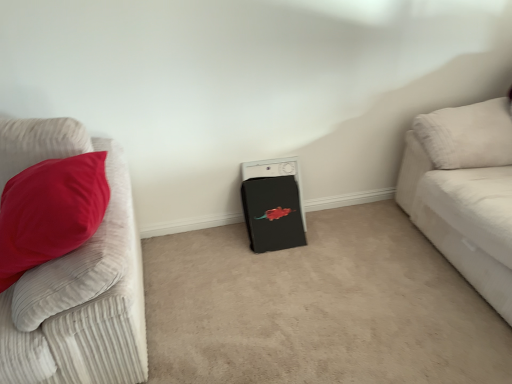
This screenshot has width=512, height=384. Describe the element at coordinates (464, 192) in the screenshot. I see `white corduroy couch at right, the 2th studio couch when ordered from left to right` at that location.

The image size is (512, 384). Identify the location of velvet red pillow at left, placed as the 1th studio couch when sorted from left to right. (77, 277).

What is the approximate width of black matte washing machine at center?

black matte washing machine at center is 24.43 centimeters wide.

I want to click on white corduroy couch at right, the first studio couch viewed from the right, so click(x=464, y=192).

Is point (269, 211) in front of point (509, 116)?

That is False.

Is black matte washing machine at center oriented away from white corduroy couch at right, the 2th studio couch when ordered from left to right?

No, black matte washing machine at center is not facing away from white corduroy couch at right, the 2th studio couch when ordered from left to right.

Which object is positioned more to the left, black matte washing machine at center or white corduroy couch at right, the first studio couch viewed from the right?

black matte washing machine at center is more to the left.

Between black matte washing machine at center and white corduroy couch at right, the first studio couch viewed from the right, which one is positioned in front?

white corduroy couch at right, the first studio couch viewed from the right, is closer to the camera.

Considering the relative sizes of velvet red pillow at left, placed as the 1th studio couch when sorted from left to right, and white corduroy couch at right, the 2th studio couch when ordered from left to right, in the image provided, is velvet red pillow at left, placed as the 1th studio couch when sorted from left to right, smaller than white corduroy couch at right, the 2th studio couch when ordered from left to right,?

Correct, velvet red pillow at left, placed as the 1th studio couch when sorted from left to right, occupies less space than white corduroy couch at right, the 2th studio couch when ordered from left to right.

The image size is (512, 384). Find the location of `studio couch below the white corduroy couch at right, the 2th studio couch when ordered from left to right (from the image's perspective)`. studio couch below the white corduroy couch at right, the 2th studio couch when ordered from left to right (from the image's perspective) is located at coordinates (77, 277).

Is velvet red pillow at left, placed as the 1th studio couch when sorted from left to right, directly adjacent to white corduroy couch at right, the 2th studio couch when ordered from left to right?

velvet red pillow at left, placed as the 1th studio couch when sorted from left to right, is not next to white corduroy couch at right, the 2th studio couch when ordered from left to right, and they're not touching.

From the image's perspective, between velvet red pillow at left, placed as the 1th studio couch when sorted from left to right, and white corduroy couch at right, the 2th studio couch when ordered from left to right, which one is located above?

From the image's view, white corduroy couch at right, the 2th studio couch when ordered from left to right, is above.

Is point (41, 144) less distant than point (283, 177)?

Yes.

Considering the relative sizes of velvet red pillow at left, placed as the 2th studio couch when sorted from right to left, and black matte washing machine at center in the image provided, is velvet red pillow at left, placed as the 2th studio couch when sorted from right to left, taller than black matte washing machine at center?

Indeed, velvet red pillow at left, placed as the 2th studio couch when sorted from right to left, has a greater height compared to black matte washing machine at center.

Is velvet red pillow at left, placed as the 2th studio couch when sorted from right to left, to the left of black matte washing machine at center from the viewer's perspective?

Yes, velvet red pillow at left, placed as the 2th studio couch when sorted from right to left, is to the left of black matte washing machine at center.

From the image's perspective, is velvet red pillow at left, placed as the 1th studio couch when sorted from left to right, above or below black matte washing machine at center?

velvet red pillow at left, placed as the 1th studio couch when sorted from left to right, is situated lower than black matte washing machine at center in the image.

Between point (286, 215) and point (133, 261), which one is positioned in front?

The point (133, 261) is more forward.

You are a GUI agent. You are given a task and a screenshot of the screen. Output one action in this format:
    pyautogui.click(x=<x>, y=<y>)
    Task: Click on the appliance located underneath the velvet red pillow at left, placed as the 1th studio couch when sorted from left to right (from a real-world perspective)
    This screenshot has height=384, width=512.
    Given the screenshot: What is the action you would take?
    pyautogui.click(x=273, y=204)

Considering the relative positions of black matte washing machine at center and velvet red pillow at left, placed as the 2th studio couch when sorted from right to left, in the image provided, is black matte washing machine at center to the right of velvet red pillow at left, placed as the 2th studio couch when sorted from right to left, from the viewer's perspective?

Yes, black matte washing machine at center is to the right of velvet red pillow at left, placed as the 2th studio couch when sorted from right to left.

How far apart are black matte washing machine at center and velvet red pillow at left, placed as the 1th studio couch when sorted from left to right?

black matte washing machine at center and velvet red pillow at left, placed as the 1th studio couch when sorted from left to right, are 35.77 inches apart.

Is white corduroy couch at right, the 2th studio couch when ordered from left to right, positioned with its back to velvet red pillow at left, placed as the 1th studio couch when sorted from left to right?

That's not correct — white corduroy couch at right, the 2th studio couch when ordered from left to right, is not looking away from velvet red pillow at left, placed as the 1th studio couch when sorted from left to right.

Who is taller, white corduroy couch at right, the first studio couch viewed from the right, or velvet red pillow at left, placed as the 1th studio couch when sorted from left to right?

white corduroy couch at right, the first studio couch viewed from the right, is taller.

Considering the relative sizes of white corduroy couch at right, the first studio couch viewed from the right, and velvet red pillow at left, placed as the 2th studio couch when sorted from right to left, in the image provided, is white corduroy couch at right, the first studio couch viewed from the right, wider than velvet red pillow at left, placed as the 2th studio couch when sorted from right to left,?

Correct, the width of white corduroy couch at right, the first studio couch viewed from the right, exceeds that of velvet red pillow at left, placed as the 2th studio couch when sorted from right to left.

Can you confirm if white corduroy couch at right, the first studio couch viewed from the right, is smaller than velvet red pillow at left, placed as the 2th studio couch when sorted from right to left?

Actually, white corduroy couch at right, the first studio couch viewed from the right, might be larger than velvet red pillow at left, placed as the 2th studio couch when sorted from right to left.

Which object is further away from the camera taking this photo, white corduroy couch at right, the first studio couch viewed from the right, or black matte washing machine at center?

black matte washing machine at center.

The height and width of the screenshot is (384, 512). Identify the location of studio couch that is the 1st object located in front of the black matte washing machine at center. (464, 192).

How much distance is there between white corduroy couch at right, the first studio couch viewed from the right, and black matte washing machine at center?

The distance of white corduroy couch at right, the first studio couch viewed from the right, from black matte washing machine at center is 31.51 inches.

Where is `the 1st studio couch above the black matte washing machine at center (from a real-world perspective)`? the 1st studio couch above the black matte washing machine at center (from a real-world perspective) is located at coordinates (464, 192).

The height and width of the screenshot is (384, 512). I want to click on studio couch in front of the white corduroy couch at right, the 2th studio couch when ordered from left to right, so click(x=77, y=277).

From the image, which object appears to be nearer to white corduroy couch at right, the first studio couch viewed from the right, black matte washing machine at center or velvet red pillow at left, placed as the 2th studio couch when sorted from right to left?

Based on the image, black matte washing machine at center appears to be nearer to white corduroy couch at right, the first studio couch viewed from the right.

Estimate the real-world distances between objects in this image. Which object is further from velvet red pillow at left, placed as the 2th studio couch when sorted from right to left, white corduroy couch at right, the 2th studio couch when ordered from left to right, or black matte washing machine at center?

white corduroy couch at right, the 2th studio couch when ordered from left to right, lies further to velvet red pillow at left, placed as the 2th studio couch when sorted from right to left, than the other object.

When comparing their distances from white corduroy couch at right, the first studio couch viewed from the right, does velvet red pillow at left, placed as the 2th studio couch when sorted from right to left, or black matte washing machine at center seem closer?

black matte washing machine at center is closer to white corduroy couch at right, the first studio couch viewed from the right.

From the picture: Considering their positions, is velvet red pillow at left, placed as the 2th studio couch when sorted from right to left, positioned closer to black matte washing machine at center than white corduroy couch at right, the first studio couch viewed from the right?

The object closer to black matte washing machine at center is white corduroy couch at right, the first studio couch viewed from the right.

Looking at the image, which one is located further to black matte washing machine at center, white corduroy couch at right, the first studio couch viewed from the right, or velvet red pillow at left, placed as the 2th studio couch when sorted from right to left?

velvet red pillow at left, placed as the 2th studio couch when sorted from right to left, is positioned further to the anchor black matte washing machine at center.

Estimate the real-world distances between objects in this image. Which object is further from velvet red pillow at left, placed as the 2th studio couch when sorted from right to left, black matte washing machine at center or white corduroy couch at right, the 2th studio couch when ordered from left to right?

white corduroy couch at right, the 2th studio couch when ordered from left to right, is positioned further to the anchor velvet red pillow at left, placed as the 2th studio couch when sorted from right to left.

Locate an element on the screen. The height and width of the screenshot is (384, 512). appliance between velvet red pillow at left, placed as the 2th studio couch when sorted from right to left, and white corduroy couch at right, the 2th studio couch when ordered from left to right, from left to right is located at coordinates (273, 204).